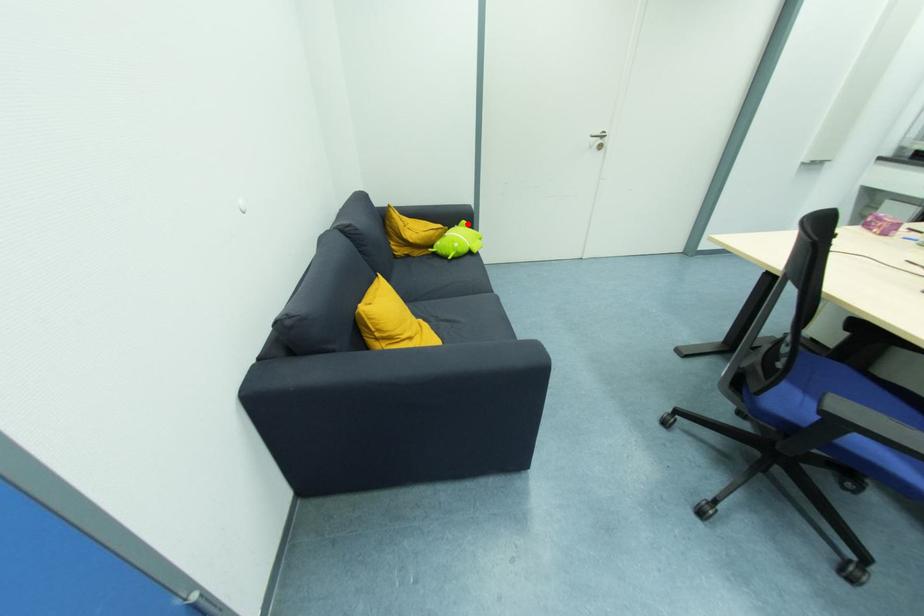
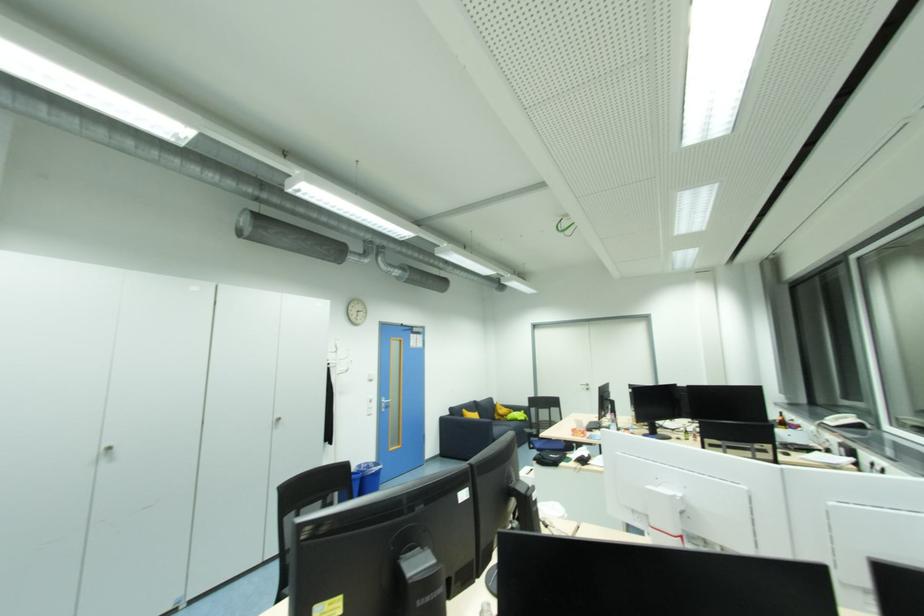
Locate, in the second image, the point that corresponds to the highlighted location in the first image.

(526, 413)